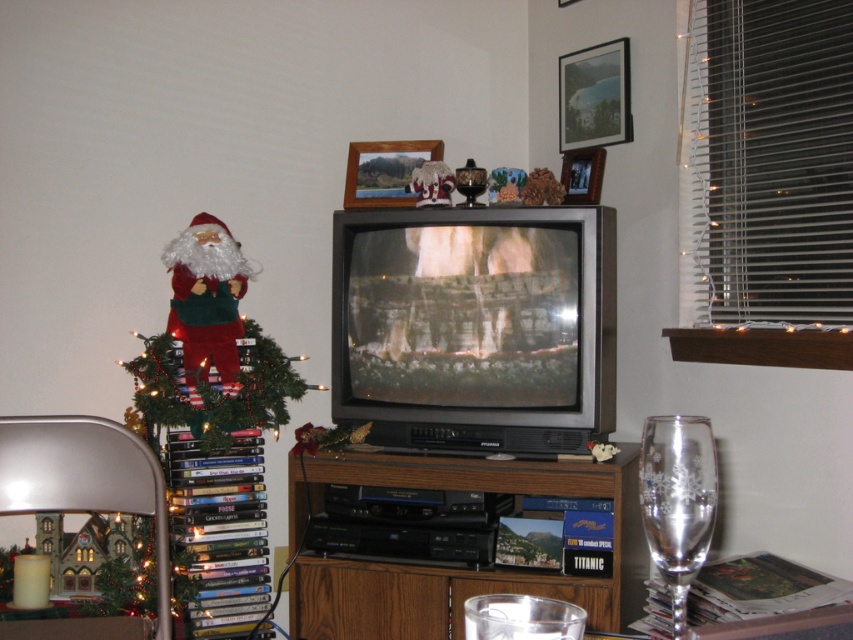
Question: Is brown wood entertainment center at center to the right of fuzzy fabric santa at left from the viewer's perspective?

Choices:
 (A) no
 (B) yes

Answer: (B)

Question: Which object appears closest to the camera in this image?

Choices:
 (A) green matte christmas tree at left
 (B) brown wood entertainment center at center
 (C) fuzzy fabric santa at left

Answer: (B)

Question: Is the position of green matte christmas tree at left less distant than that of clear glass wine glass at lower right?

Choices:
 (A) yes
 (B) no

Answer: (B)

Question: Which object is positioned closest to the clear glass wine glass at lower right?

Choices:
 (A) fuzzy fabric santa at left
 (B) brown wood entertainment center at center
 (C) green matte christmas tree at left

Answer: (B)

Question: Is clear glass wine glass at lower right below fuzzy fabric santa at left?

Choices:
 (A) yes
 (B) no

Answer: (A)

Question: Considering the real-world distances, which object is farthest from the green matte christmas tree at left?

Choices:
 (A) brown wood entertainment center at center
 (B) clear glass wine glass at lower right
 (C) fuzzy fabric santa at left

Answer: (B)